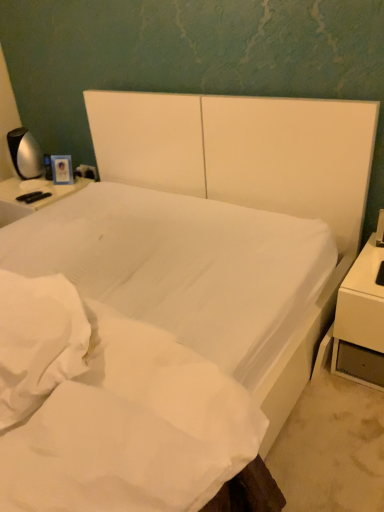
Question: Can you confirm if satin silver lamp at left is thinner than white glossy nightstand at right?

Choices:
 (A) yes
 (B) no

Answer: (A)

Question: Does satin silver lamp at left appear on the left side of white glossy nightstand at right?

Choices:
 (A) no
 (B) yes

Answer: (B)

Question: Is satin silver lamp at left further to the viewer compared to white glossy nightstand at right?

Choices:
 (A) no
 (B) yes

Answer: (B)

Question: From the image's perspective, is satin silver lamp at left below white glossy nightstand at right?

Choices:
 (A) yes
 (B) no

Answer: (B)

Question: Is satin silver lamp at left oriented away from white glossy nightstand at right?

Choices:
 (A) yes
 (B) no

Answer: (B)

Question: Does satin silver lamp at left appear on the right side of white glossy nightstand at right?

Choices:
 (A) yes
 (B) no

Answer: (B)

Question: From a real-world perspective, is satin silver lamp at left positioned over white smooth mattress at center based on gravity?

Choices:
 (A) no
 (B) yes

Answer: (B)

Question: Is satin silver lamp at left not close to white smooth mattress at center?

Choices:
 (A) no
 (B) yes

Answer: (B)

Question: Is satin silver lamp at left at the left side of white smooth mattress at center?

Choices:
 (A) no
 (B) yes

Answer: (B)

Question: Is satin silver lamp at left to the right of white smooth mattress at center from the viewer's perspective?

Choices:
 (A) yes
 (B) no

Answer: (B)

Question: From the image's perspective, is satin silver lamp at left located above white smooth mattress at center?

Choices:
 (A) no
 (B) yes

Answer: (B)

Question: Is satin silver lamp at left taller than white smooth mattress at center?

Choices:
 (A) yes
 (B) no

Answer: (B)

Question: Does white smooth mattress at center appear on the left side of white glossy nightstand at right?

Choices:
 (A) yes
 (B) no

Answer: (A)